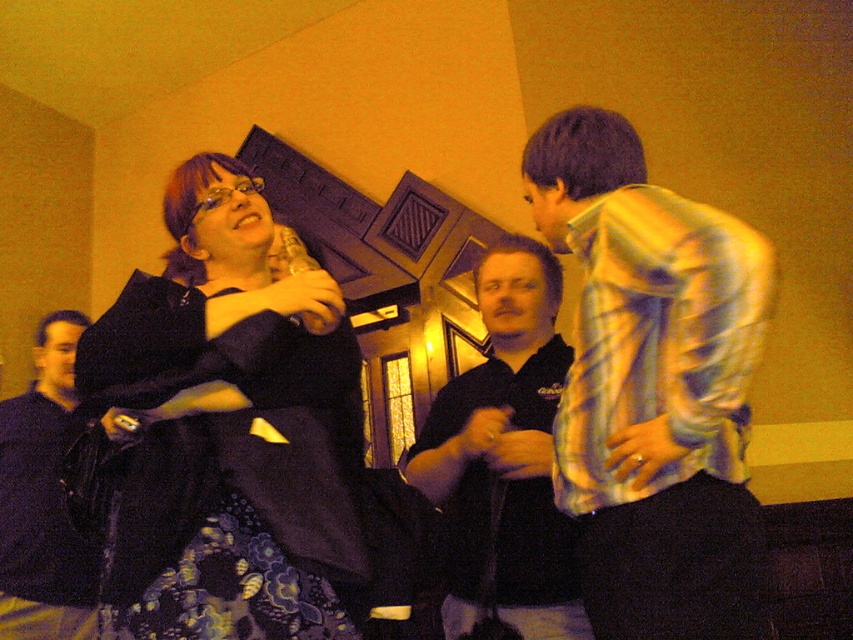
In the scene shown: You are at a social event and want to approach the person wearing the dark blue shirt at left. Which direction should you move relative to the matte black dress at center?

To reach the dark blue shirt at left from the matte black dress at center, you should move to the left since the dark blue shirt at left is positioned to the left of the matte black dress at center according to the description.

You are a photographer setting up a shoot in the room. You need to place a small prop that must fit between the matte black dress at center and the black shirt at center. Based on their sizes, which object should the prop be placed closer to?

The prop should be placed closer to the matte black dress at center because it is smaller than the black shirt at center, leaving less space on its side.